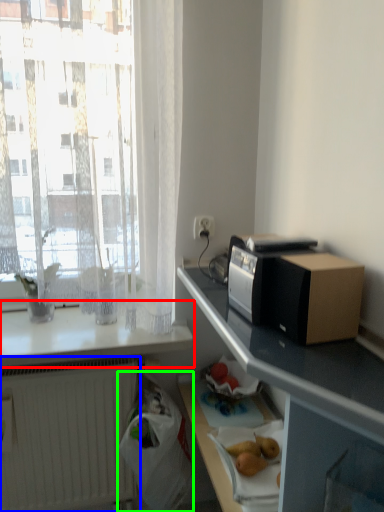
Question: Estimate the real-world distances between objects in this image. Which object is closer to countertop (highlighted by a red box), radiator (highlighted by a blue box) or shopping bag (highlighted by a green box)?

Choices:
 (A) radiator
 (B) shopping bag

Answer: (A)